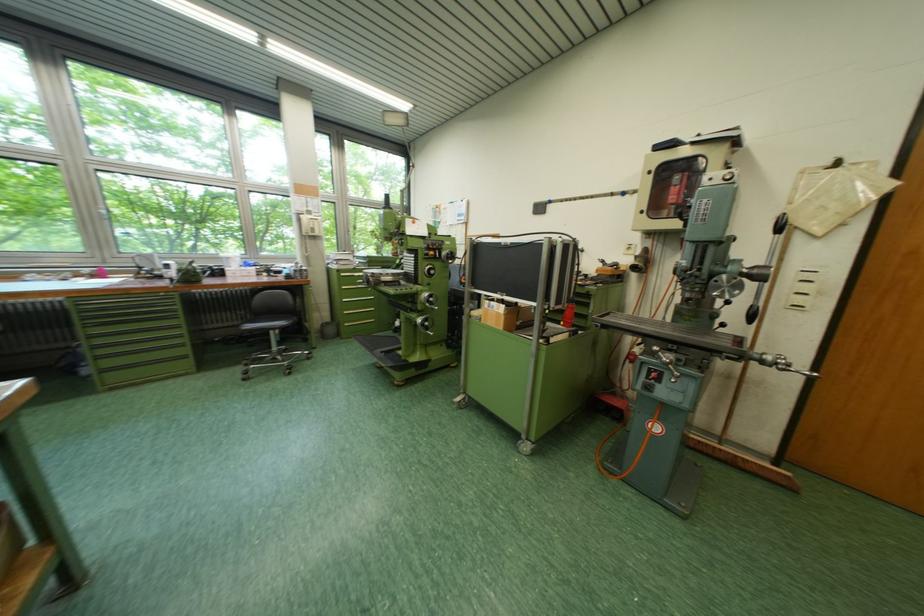
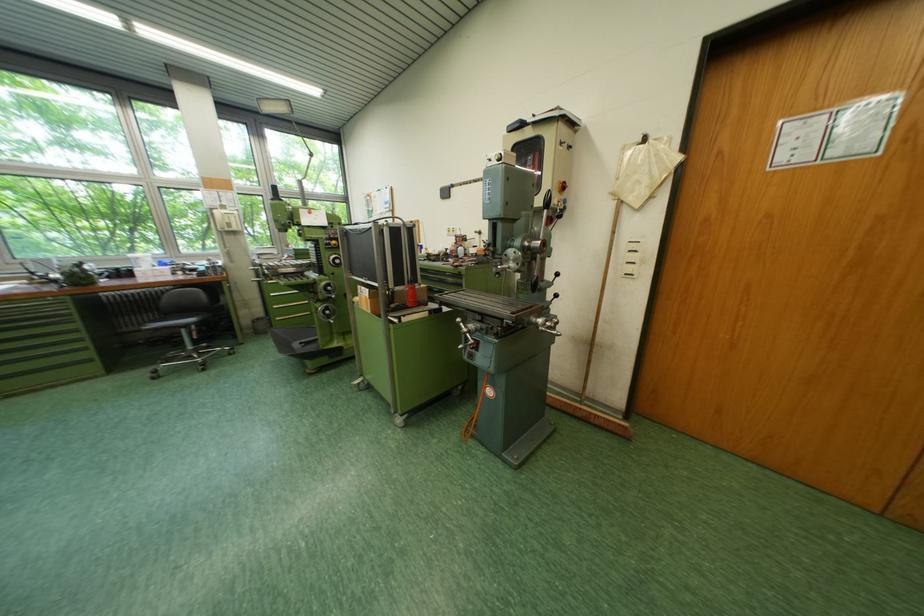
Question: Which direction would the cameraman need to move to produce the second image? Reply with the corresponding letter.

Choices:
 (A) Left
 (B) Right
 (C) Forward
 (D) Backward

Answer: (B)